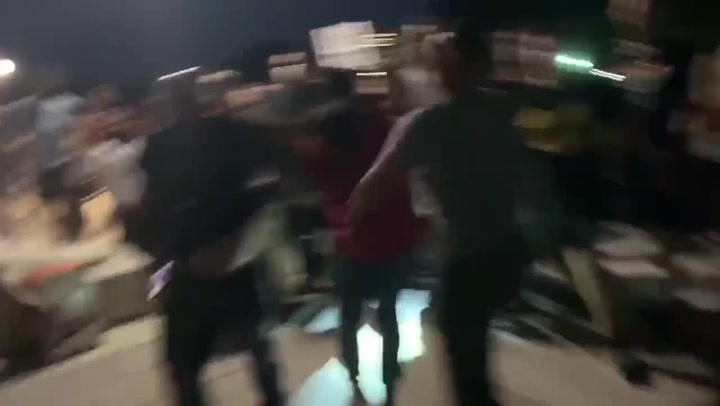
The height and width of the screenshot is (406, 720). Identify the location of yellow light. (6, 70).